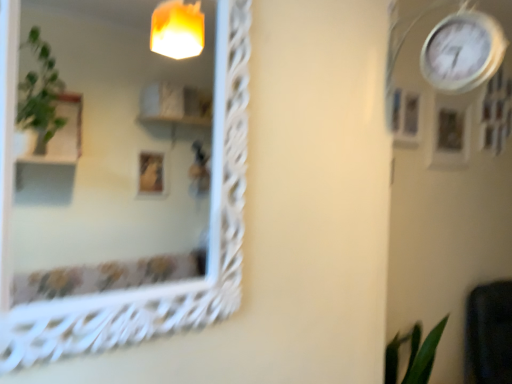
At what (x,y) coordinates should I click in order to perform the action: click on matte white picture frame at upper right, acting as the second picture frame starting from the right. Please return your answer as a coordinate pair (x, y). Looking at the image, I should click on (406, 116).

Where is `white metallic clock at upper right`? white metallic clock at upper right is located at coordinates (462, 51).

Locate an element on the screen. wooden picture frame at upper right, which appears as the second picture frame when viewed from the front is located at coordinates (450, 132).

Find the location of `matte white picture frame at upper right, marked as the 1th picture frame in a left-to-right arrangement`. matte white picture frame at upper right, marked as the 1th picture frame in a left-to-right arrangement is located at coordinates (x=406, y=116).

From a real-world perspective, count 2nd picture frames downward from the white metallic clock at upper right and point to it. Please provide its 2D coordinates.

[(450, 132)]

Does point (442, 22) come closer to viewer compared to point (452, 124)?

Yes, point (442, 22) is in front of point (452, 124).

Is white metallic clock at upper right facing away from wooden picture frame at upper right, which appears as the second picture frame when viewed from the front?

That's not correct — white metallic clock at upper right is not looking away from wooden picture frame at upper right, which appears as the second picture frame when viewed from the front.

Which object is further away from the camera, white metallic clock at upper right or wooden picture frame at upper right, which is the first picture frame from back to front?

wooden picture frame at upper right, which is the first picture frame from back to front, is further from the camera.

Which is behind, wooden picture frame at upper right, the 1th picture frame when ordered from right to left, or white metallic clock at upper right?

wooden picture frame at upper right, the 1th picture frame when ordered from right to left.

Between wooden picture frame at upper right, the 2th picture frame positioned from the left, and white metallic clock at upper right, which one appears on the right side from the viewer's perspective?

Positioned to the right is wooden picture frame at upper right, the 2th picture frame positioned from the left.

Is wooden picture frame at upper right, which is the first picture frame from back to front, next to white metallic clock at upper right and touching it?

wooden picture frame at upper right, which is the first picture frame from back to front, and white metallic clock at upper right are not in contact.

Does wooden picture frame at upper right, which appears as the second picture frame when viewed from the front, have a lesser width compared to white textured mirror at upper left?

Yes.

How much distance is there between wooden picture frame at upper right, which is the first picture frame from back to front, and white textured mirror at upper left?

5.09 feet.

Is wooden picture frame at upper right, which appears as the second picture frame when viewed from the front, with white textured mirror at upper left?

No, wooden picture frame at upper right, which appears as the second picture frame when viewed from the front, is not with white textured mirror at upper left.

Is wooden picture frame at upper right, the 2th picture frame positioned from the left, facing away from white textured mirror at upper left?

That's not correct — wooden picture frame at upper right, the 2th picture frame positioned from the left, is not looking away from white textured mirror at upper left.

From a real-world perspective, who is located lower, matte white picture frame at upper right, which is the first picture frame from front to back, or wooden picture frame at upper right, the 1th picture frame when ordered from right to left?

From a 3D spatial view, wooden picture frame at upper right, the 1th picture frame when ordered from right to left, is below.

Would you consider matte white picture frame at upper right, the second picture frame from the back, to be distant from wooden picture frame at upper right, which appears as the second picture frame when viewed from the front?

No, matte white picture frame at upper right, the second picture frame from the back, is in close proximity to wooden picture frame at upper right, which appears as the second picture frame when viewed from the front.

From the image's perspective, which one is positioned higher, matte white picture frame at upper right, which is the first picture frame from front to back, or wooden picture frame at upper right, the 2th picture frame positioned from the left?

matte white picture frame at upper right, which is the first picture frame from front to back.

Is matte white picture frame at upper right, which is the first picture frame from front to back, taller or shorter than wooden picture frame at upper right, the 2th picture frame positioned from the left?

Considering their sizes, matte white picture frame at upper right, which is the first picture frame from front to back, has less height than wooden picture frame at upper right, the 2th picture frame positioned from the left.

Between white textured mirror at upper left and white metallic clock at upper right, which one has less height?

With less height is white metallic clock at upper right.

Is white textured mirror at upper left turned away from white metallic clock at upper right?

white textured mirror at upper left is not turned away from white metallic clock at upper right.

Which object is further away from the camera, white textured mirror at upper left or white metallic clock at upper right?

white metallic clock at upper right.

In the scene shown: Is white textured mirror at upper left placed right next to white metallic clock at upper right?

There is a gap between white textured mirror at upper left and white metallic clock at upper right.

Looking at this image, between white metallic clock at upper right and white textured mirror at upper left, which one has more height?

white textured mirror at upper left is taller.

Could you tell me if white metallic clock at upper right is facing white textured mirror at upper left?

No, white metallic clock at upper right is not turned towards white textured mirror at upper left.

Would you say white metallic clock at upper right is outside white textured mirror at upper left?

white metallic clock at upper right is positioned outside white textured mirror at upper left.

Which is closer to the camera, (500, 44) or (409, 91)?

Point (500, 44) is positioned farther from the camera compared to point (409, 91).

Does white metallic clock at upper right have a greater height compared to matte white picture frame at upper right, the second picture frame from the back?

Yes, white metallic clock at upper right is taller than matte white picture frame at upper right, the second picture frame from the back.

From the image's perspective, which object appears higher, white metallic clock at upper right or matte white picture frame at upper right, which is the first picture frame from front to back?

white metallic clock at upper right.

From the picture: Is white metallic clock at upper right not close to matte white picture frame at upper right, which is the first picture frame from front to back?

white metallic clock at upper right is near matte white picture frame at upper right, which is the first picture frame from front to back, not far away.

Find the location of a particular element. The image size is (512, 384). clock above the wooden picture frame at upper right, which appears as the second picture frame when viewed from the front (from a real-world perspective) is located at coordinates (462, 51).

Locate an element on the screen. This screenshot has width=512, height=384. the 2nd picture frame located beneath the white metallic clock at upper right (from a real-world perspective) is located at coordinates (x=450, y=132).

Looking at the image, which one is located further to wooden picture frame at upper right, which appears as the second picture frame when viewed from the front, matte white picture frame at upper right, the second picture frame from the back, or white textured mirror at upper left?

white textured mirror at upper left is positioned further to the anchor wooden picture frame at upper right, which appears as the second picture frame when viewed from the front.

When comparing their distances from wooden picture frame at upper right, which appears as the second picture frame when viewed from the front, does white metallic clock at upper right or white textured mirror at upper left seem further?

Among the two, white textured mirror at upper left is located further to wooden picture frame at upper right, which appears as the second picture frame when viewed from the front.

Based on the photo, looking at the image, which one is located closer to white textured mirror at upper left, white metallic clock at upper right or wooden picture frame at upper right, the 2th picture frame positioned from the left?

white metallic clock at upper right.

When comparing their distances from white metallic clock at upper right, does matte white picture frame at upper right, marked as the 1th picture frame in a left-to-right arrangement, or wooden picture frame at upper right, which is the first picture frame from back to front, seem closer?

Based on the image, matte white picture frame at upper right, marked as the 1th picture frame in a left-to-right arrangement, appears to be nearer to white metallic clock at upper right.

When comparing their distances from matte white picture frame at upper right, acting as the second picture frame starting from the right, does white metallic clock at upper right or wooden picture frame at upper right, the 1th picture frame when ordered from right to left, seem further?

Based on the image, white metallic clock at upper right appears to be further to matte white picture frame at upper right, acting as the second picture frame starting from the right.

From the image, which object appears to be farther from wooden picture frame at upper right, which appears as the second picture frame when viewed from the front, white metallic clock at upper right or matte white picture frame at upper right, marked as the 1th picture frame in a left-to-right arrangement?

white metallic clock at upper right is further to wooden picture frame at upper right, which appears as the second picture frame when viewed from the front.

Estimate the real-world distances between objects in this image. Which object is closer to wooden picture frame at upper right, which appears as the second picture frame when viewed from the front, white textured mirror at upper left or white metallic clock at upper right?

white metallic clock at upper right lies closer to wooden picture frame at upper right, which appears as the second picture frame when viewed from the front, than the other object.

When comparing their distances from white textured mirror at upper left, does white metallic clock at upper right or matte white picture frame at upper right, which is the first picture frame from front to back, seem further?

matte white picture frame at upper right, which is the first picture frame from front to back, is further to white textured mirror at upper left.

You are a GUI agent. You are given a task and a screenshot of the screen. Output one action in this format:
    pyautogui.click(x=<x>, y=<y>)
    Task: Click on the clock between white textured mirror at upper left and matte white picture frame at upper right, acting as the second picture frame starting from the right, along the z-axis
    
    Given the screenshot: What is the action you would take?
    pyautogui.click(x=462, y=51)

The image size is (512, 384). I want to click on clock between white textured mirror at upper left and wooden picture frame at upper right, which appears as the second picture frame when viewed from the front, along the z-axis, so click(462, 51).

Find the location of a particular element. The width and height of the screenshot is (512, 384). picture frame between white textured mirror at upper left and wooden picture frame at upper right, the 2th picture frame positioned from the left, along the z-axis is located at coordinates [x=406, y=116].

Where is `picture frame between white metallic clock at upper right and wooden picture frame at upper right, the 2th picture frame positioned from the left, in the front-back direction`? The image size is (512, 384). picture frame between white metallic clock at upper right and wooden picture frame at upper right, the 2th picture frame positioned from the left, in the front-back direction is located at coordinates (406, 116).